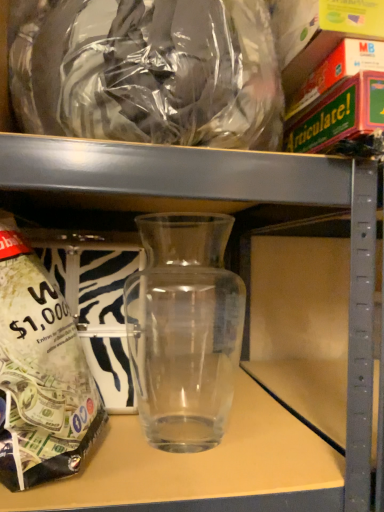
Question: From the image's perspective, is transparent glass jar at left over transparent glass vase at center?

Choices:
 (A) yes
 (B) no

Answer: (B)

Question: Is transparent glass jar at left positioned beyond the bounds of transparent glass vase at center?

Choices:
 (A) no
 (B) yes

Answer: (B)

Question: Does transparent glass jar at left have a greater height compared to transparent glass vase at center?

Choices:
 (A) yes
 (B) no

Answer: (A)

Question: From the image's perspective, is transparent glass jar at left beneath transparent glass vase at center?

Choices:
 (A) no
 (B) yes

Answer: (B)

Question: From a real-world perspective, is transparent glass jar at left on transparent glass vase at center?

Choices:
 (A) no
 (B) yes

Answer: (A)

Question: Is transparent glass jar at left in contact with transparent glass vase at center?

Choices:
 (A) no
 (B) yes

Answer: (A)

Question: Is transparent plastic bag at upper center shorter than transparent glass jar at left?

Choices:
 (A) no
 (B) yes

Answer: (A)

Question: Does transparent plastic bag at upper center have a greater width compared to transparent glass jar at left?

Choices:
 (A) yes
 (B) no

Answer: (B)

Question: From a real-world perspective, is transparent plastic bag at upper center on top of transparent glass jar at left?

Choices:
 (A) yes
 (B) no

Answer: (A)

Question: Does transparent plastic bag at upper center have a lesser width compared to transparent glass jar at left?

Choices:
 (A) yes
 (B) no

Answer: (A)

Question: Can you confirm if transparent plastic bag at upper center is taller than transparent glass jar at left?

Choices:
 (A) no
 (B) yes

Answer: (B)

Question: Is transparent plastic bag at upper center smaller than transparent glass jar at left?

Choices:
 (A) yes
 (B) no

Answer: (A)

Question: Does transparent glass jar at left have a greater width compared to transparent plastic bag at upper center?

Choices:
 (A) yes
 (B) no

Answer: (A)